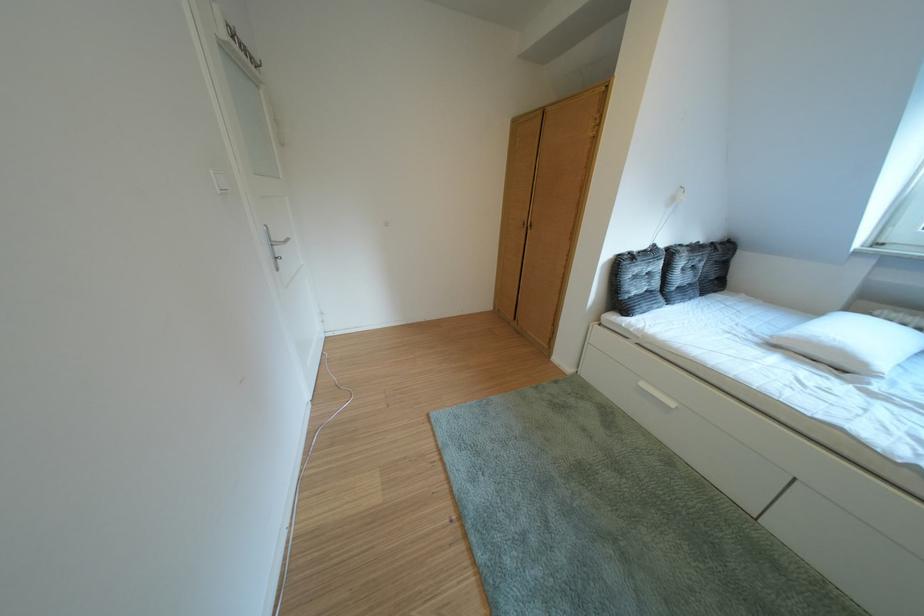
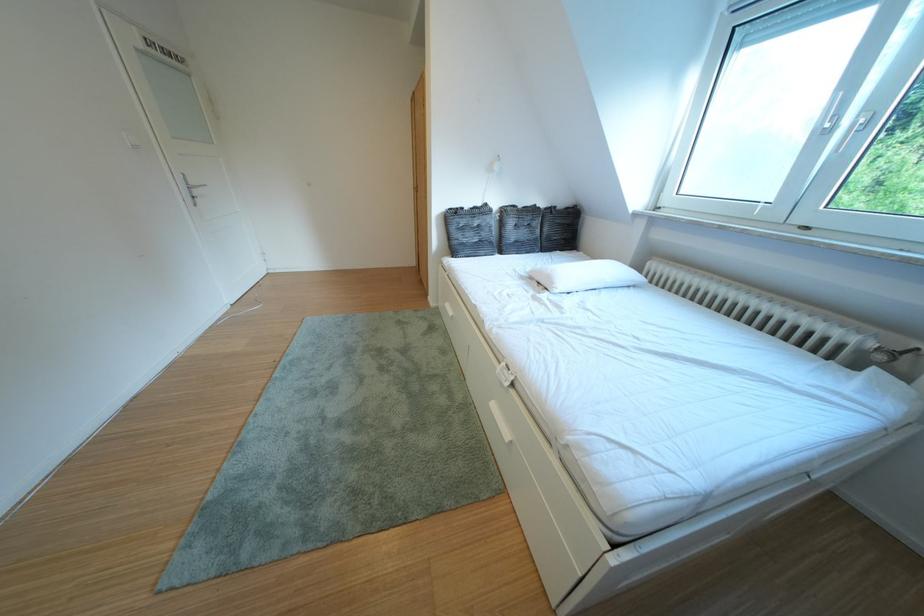
In the second image, find the point that corresponds to the point at 640,301 in the first image.

(468, 246)